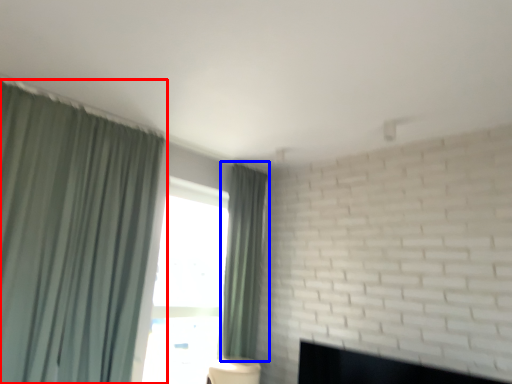
Question: Which object is closer to the camera taking this photo, curtain (highlighted by a red box) or curtain (highlighted by a blue box)?

Choices:
 (A) curtain
 (B) curtain

Answer: (A)